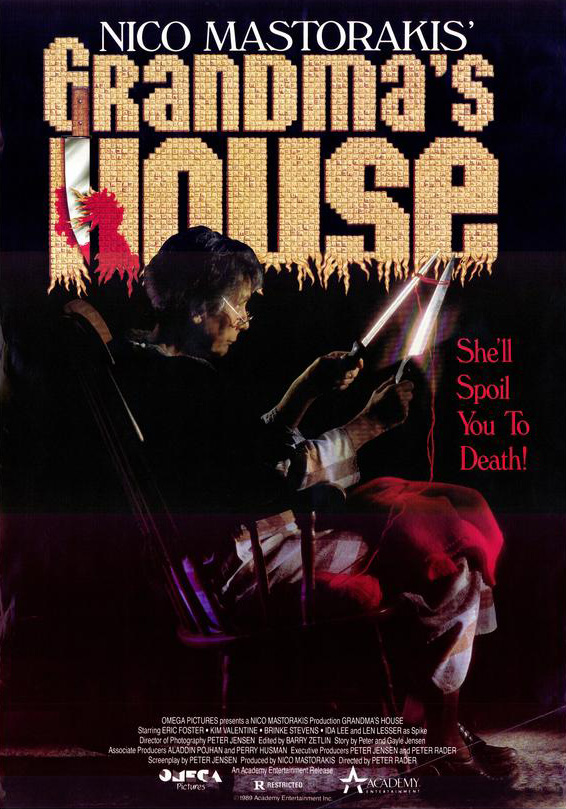
What are the coordinates of `swinging chair` in the screenshot? It's located at (158, 527).